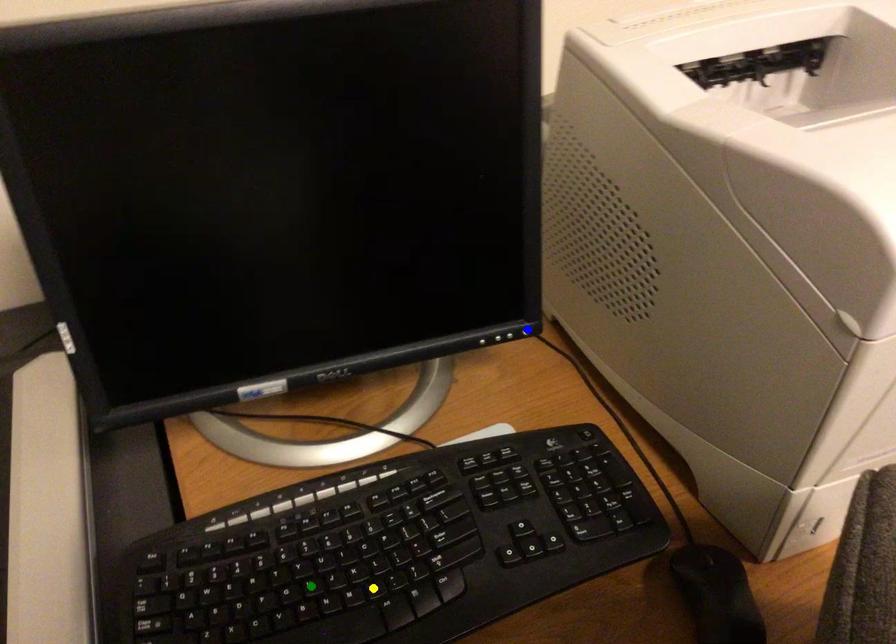
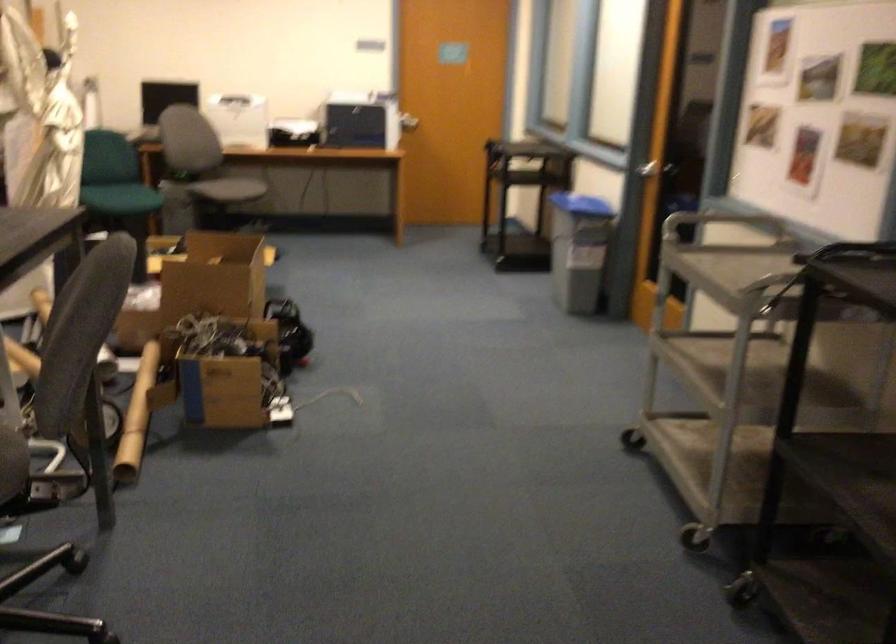
I am providing you with two images of the same scene from different viewpoints. Three points are marked in image1. Which point corresponds to a part or object that is occluded in image2?In image1, three points are marked. Which of them correspond to a part or object that is occluded in image2?Among the three points shown in image1, which one corresponds to a part or object that is no longer visible due to occlusion in image2?

blue point, yellow point, green point